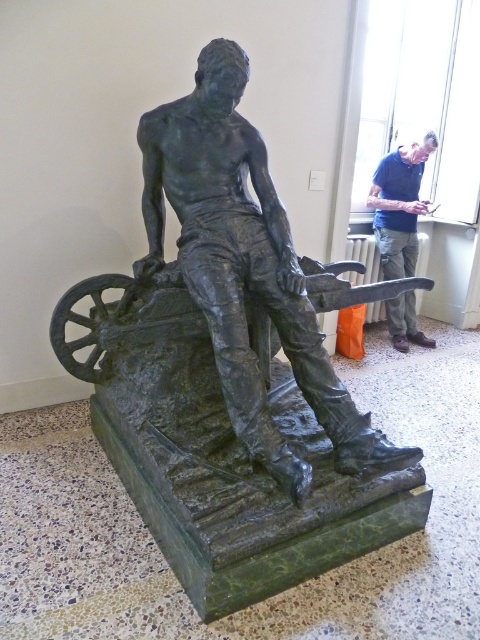
Question: Is bronze statue at center positioned behind blue shirt at upper right?

Choices:
 (A) yes
 (B) no

Answer: (B)

Question: Is the position of bronze statue at center more distant than that of blue shirt at upper right?

Choices:
 (A) yes
 (B) no

Answer: (B)

Question: Is bronze statue at center further to camera compared to blue shirt at upper right?

Choices:
 (A) yes
 (B) no

Answer: (B)

Question: Which point appears farthest from the camera in this image?

Choices:
 (A) pyautogui.click(x=321, y=369)
 (B) pyautogui.click(x=383, y=180)

Answer: (B)

Question: Among these objects, which one is nearest to the camera?

Choices:
 (A) blue shirt at upper right
 (B) bronze statue at center

Answer: (B)

Question: Which point is closer to the camera?

Choices:
 (A) (385, 166)
 (B) (188, 296)

Answer: (B)